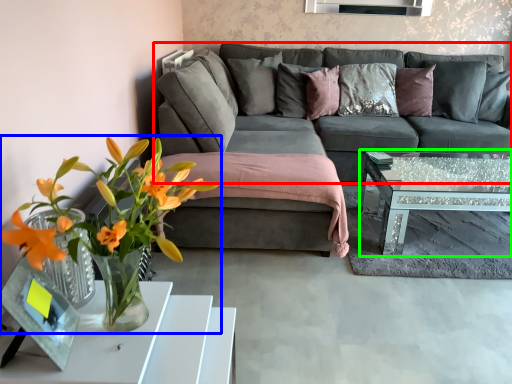
Question: Based on their relative distances, which object is farther from studio couch (highlighted by a red box)? Choose from houseplant (highlighted by a blue box) and coffee table (highlighted by a green box).

Choices:
 (A) houseplant
 (B) coffee table

Answer: (A)